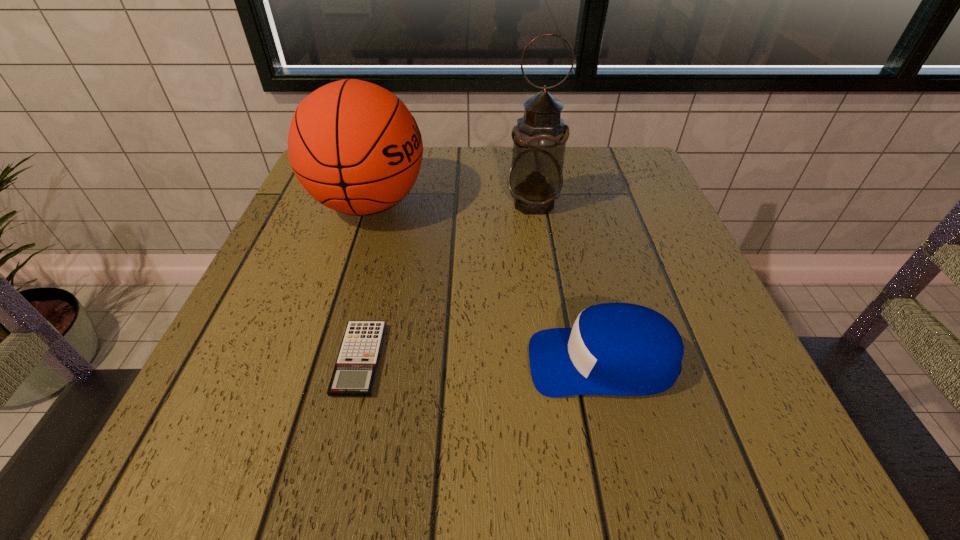
Identify the location of vacant area at the far right corner. (624, 172).

Identify the location of vacant space at the near right corner of the desktop. The width and height of the screenshot is (960, 540). (701, 446).

At what (x,y) coordinates should I click in order to perform the action: click on unoccupied position between the second shortest object and the basketball. Please return your answer as a coordinate pair (x, y). The width and height of the screenshot is (960, 540). Looking at the image, I should click on (486, 282).

I want to click on free space between the baseball cap and the shortest object, so click(x=481, y=360).

Locate an element on the screen. This screenshot has width=960, height=540. free spot between the baseball cap and the shortest object is located at coordinates (481, 360).

I want to click on vacant area that lies between the basketball and the tallest object, so click(x=451, y=204).

The width and height of the screenshot is (960, 540). Identify the location of free spot between the oil lamp and the second tallest object. (451, 204).

Find the location of a particular element. Image resolution: width=960 pixels, height=540 pixels. vacant space that is in between the baseball cap and the calculator is located at coordinates (481, 360).

You are a GUI agent. You are given a task and a screenshot of the screen. Output one action in this format:
    pyautogui.click(x=<x>, y=<y>)
    Task: Click on the vacant region between the oil lamp and the basketball
    
    Given the screenshot: What is the action you would take?
    pyautogui.click(x=451, y=204)

Image resolution: width=960 pixels, height=540 pixels. Identify the location of blank region between the baseball cap and the oil lamp. (568, 282).